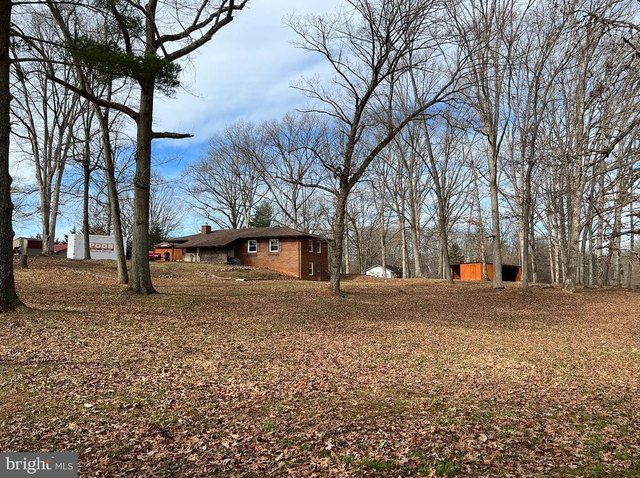
This screenshot has width=640, height=478. I want to click on windows, so tap(252, 248), tap(272, 245), tap(312, 246), tap(317, 247), tap(310, 267).